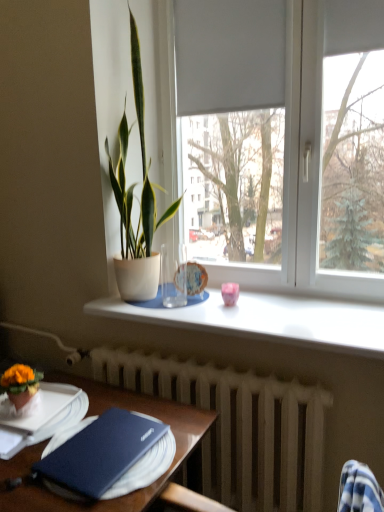
Question: Is matte white pot at center, marked as the 2th houseplant in a left-to-right arrangement, in contact with matte blue hardback book at lower left?

Choices:
 (A) no
 (B) yes

Answer: (A)

Question: From the image's perspective, does matte white pot at center, acting as the first houseplant starting from the top, appear higher than matte blue hardback book at lower left?

Choices:
 (A) no
 (B) yes

Answer: (B)

Question: Considering the relative sizes of matte white pot at center, the second houseplant in the bottom-to-top sequence, and matte blue hardback book at lower left in the image provided, is matte white pot at center, the second houseplant in the bottom-to-top sequence, wider than matte blue hardback book at lower left?

Choices:
 (A) yes
 (B) no

Answer: (A)

Question: Is matte white pot at center, marked as the 2th houseplant in a left-to-right arrangement, closer to the viewer compared to matte blue hardback book at lower left?

Choices:
 (A) no
 (B) yes

Answer: (A)

Question: From the image's perspective, is matte white pot at center, marked as the 2th houseplant in a left-to-right arrangement, under matte blue hardback book at lower left?

Choices:
 (A) no
 (B) yes

Answer: (A)

Question: Is matte white pot at center, the second houseplant from the front, shorter than matte blue hardback book at lower left?

Choices:
 (A) yes
 (B) no

Answer: (B)

Question: Would you say white matte window at center is part of matte white pot at center, which is the 1th houseplant in right-to-left order,'s contents?

Choices:
 (A) yes
 (B) no

Answer: (B)

Question: Does matte white pot at center, the second houseplant in the bottom-to-top sequence, have a lesser width compared to white matte window at center?

Choices:
 (A) no
 (B) yes

Answer: (A)

Question: Considering the relative sizes of matte white pot at center, the second houseplant from the front, and white matte window at center in the image provided, is matte white pot at center, the second houseplant from the front, smaller than white matte window at center?

Choices:
 (A) no
 (B) yes

Answer: (B)

Question: Is matte white pot at center, the second houseplant from the front, positioned with its back to white matte window at center?

Choices:
 (A) yes
 (B) no

Answer: (A)

Question: From the image's perspective, does matte white pot at center, which is the 1th houseplant in right-to-left order, appear lower than white matte window at center?

Choices:
 (A) no
 (B) yes

Answer: (B)

Question: From a real-world perspective, does matte white pot at center, marked as the 2th houseplant in a left-to-right arrangement, stand above white matte window at center?

Choices:
 (A) yes
 (B) no

Answer: (B)

Question: Does pink glossy cup at center, the 2th tableware from the back, have a greater width compared to orange felt flower pot at lower left, arranged as the 1th houseplant when ordered from the bottom?

Choices:
 (A) no
 (B) yes

Answer: (A)